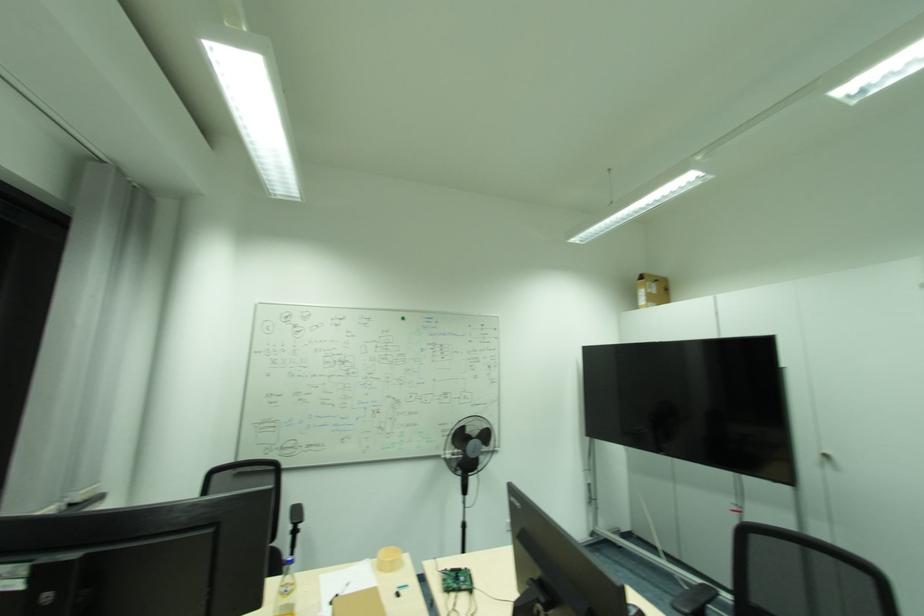
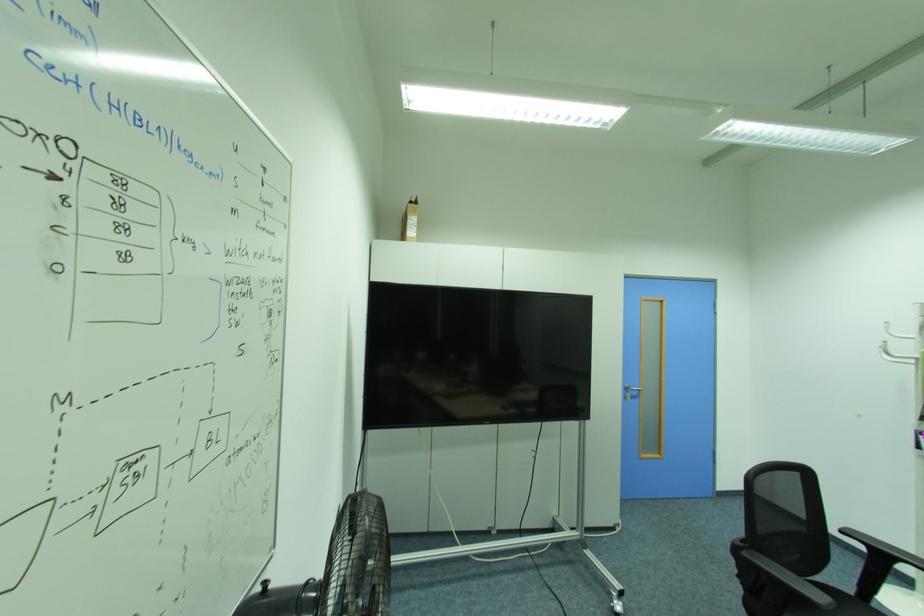
The point at (639, 307) is marked in the first image. Where is the corresponding point in the second image?

(407, 237)